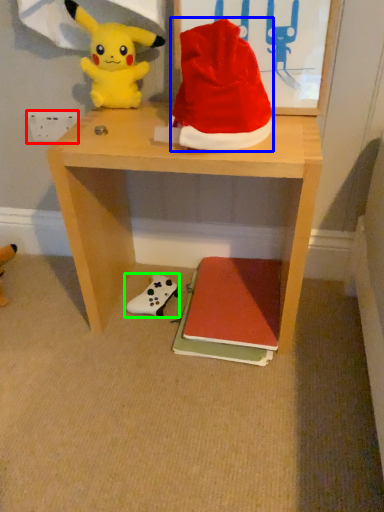
Question: Which is nearer to the power outlet (highlighted by a red box)? hat (highlighted by a blue box) or toy (highlighted by a green box).

Choices:
 (A) hat
 (B) toy

Answer: (A)